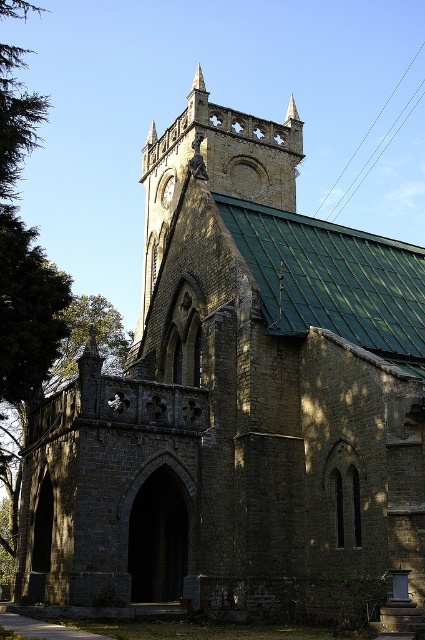
You are standing in front of the Gothic church and looking at its tower. You notice two points marked on the tower. One is at coordinate point (113, 340) and the other is at point (166, 204). Which point is closer to you?

Point (113, 340) is closer to you because it is further to the viewer than point (166, 204).

Consider the image. You are standing in front of the Gothic church and want to take a photo that includes both the green leafy tree at left and the tower. Based on their positions, which object should you position closer to the left side of the frame?

The green leafy tree at left is located at point [85,339], which means it is positioned closer to the left side of the frame compared to the tower. Therefore, you should position the green leafy tree at left closer to the left side of the frame.